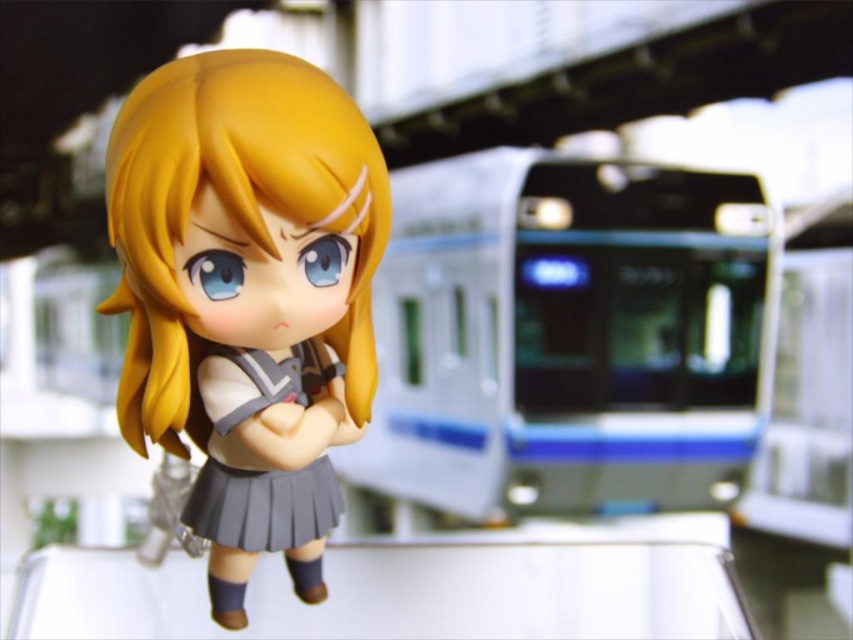
Who is higher up, metallic silver train at center or matte plastic doll at center?

Positioned higher is metallic silver train at center.

Can you confirm if metallic silver train at center is positioned above matte plastic doll at center?

Correct, metallic silver train at center is located above matte plastic doll at center.

Between point (424, 380) and point (274, 541), which one is positioned behind?

The point (424, 380) is behind.

Find the location of a particular element. This screenshot has height=640, width=853. metallic silver train at center is located at coordinates (569, 336).

Which is above, metallic silver train at center or gray pleated skirt at center?

metallic silver train at center is higher up.

Does metallic silver train at center appear on the right side of gray pleated skirt at center?

Yes, metallic silver train at center is to the right of gray pleated skirt at center.

Between point (380, 282) and point (329, 465), which one is positioned behind?

The point (329, 465) is behind.

Locate an element on the screen. The width and height of the screenshot is (853, 640). metallic silver train at center is located at coordinates (569, 336).

Does matte plastic doll at center appear on the left side of gray pleated skirt at center?

Yes, matte plastic doll at center is to the left of gray pleated skirt at center.

Does matte plastic doll at center appear over gray pleated skirt at center?

Indeed, matte plastic doll at center is positioned over gray pleated skirt at center.

Measure the distance between point (170, 330) and camera.

They are 14.16 inches apart.

You are a GUI agent. You are given a task and a screenshot of the screen. Output one action in this format:
    pyautogui.click(x=<x>, y=<y>)
    Task: Click on the matte plastic doll at center
    
    Given the screenshot: What is the action you would take?
    pyautogui.click(x=247, y=296)